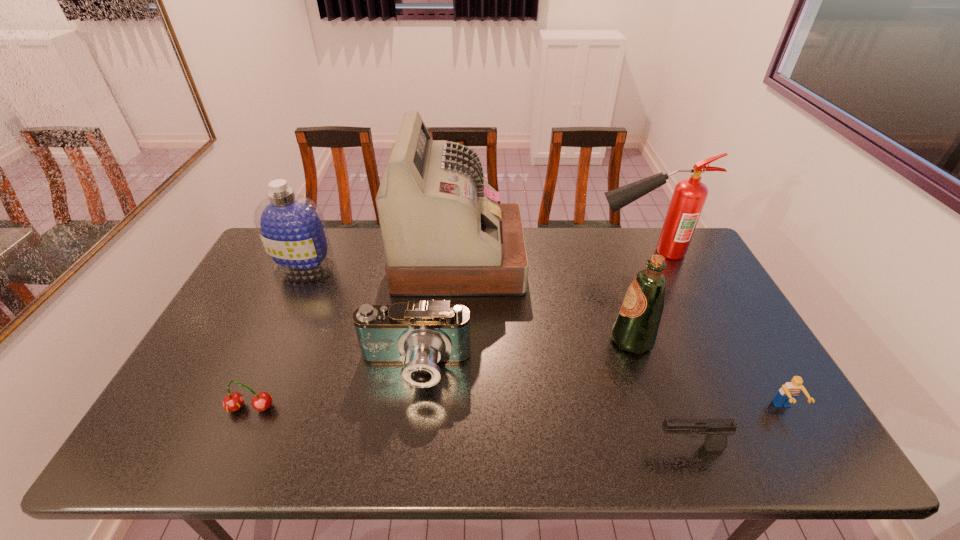
The width and height of the screenshot is (960, 540). I want to click on the tallest object, so click(x=444, y=234).

What are the coordinates of `fire extinguisher` in the screenshot? It's located at (689, 196).

Locate an element on the screen. cleansing agent is located at coordinates (292, 229).

Find the location of a particular element. olive oil is located at coordinates pos(635,329).

Identify the location of the fifth tallest object. (419, 335).

What are the coordinates of `the nearest object` in the screenshot? It's located at (715, 430).

The width and height of the screenshot is (960, 540). I want to click on cherry, so click(x=233, y=401).

I want to click on Lego, so click(x=787, y=394).

Find the location of a particular element. The height and width of the screenshot is (540, 960). free space located on the operating side of the tallest object is located at coordinates (552, 260).

The width and height of the screenshot is (960, 540). Identify the location of blank space located 0.180m at the nozzle of the fire extinguisher. (541, 252).